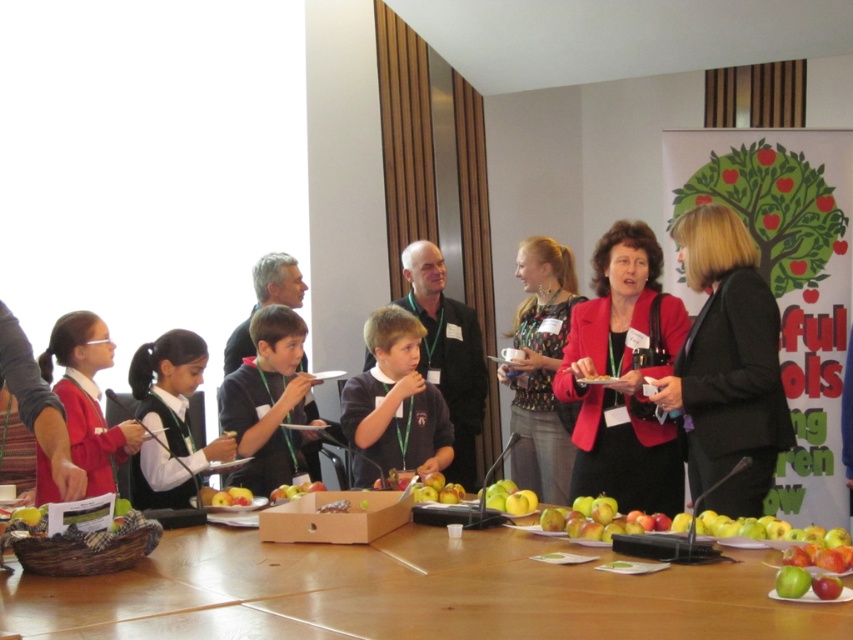
Question: Does wooden table at center appear on the right side of black fabric jacket at center?

Choices:
 (A) yes
 (B) no

Answer: (B)

Question: Is matte red blazer at center positioned at the back of smooth wooden table at center?

Choices:
 (A) yes
 (B) no

Answer: (B)

Question: In this image, where is black fabric jacket at center located relative to smooth wooden table at center?

Choices:
 (A) right
 (B) left

Answer: (B)

Question: Which point appears farthest from the camera in this image?

Choices:
 (A) (527, 452)
 (B) (850, 353)
 (C) (254, 413)
 (D) (708, 481)

Answer: (A)

Question: Which point is farther to the camera?

Choices:
 (A) (100, 488)
 (B) (851, 522)

Answer: (B)

Question: Among these objects, which one is farthest from the camera?

Choices:
 (A) printed fabric blouse at center
 (B) smooth wooden table at center

Answer: (A)